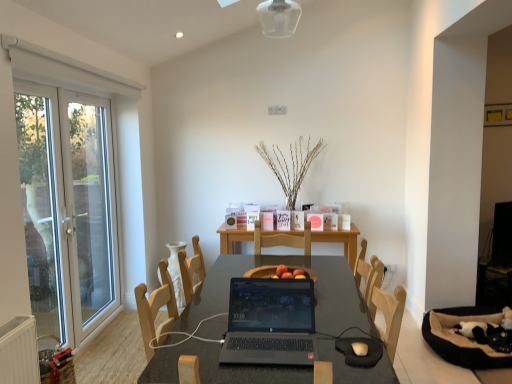
Find the location of a particular element. This screenshot has height=384, width=512. free point behind matte white mouse at center is located at coordinates (352, 328).